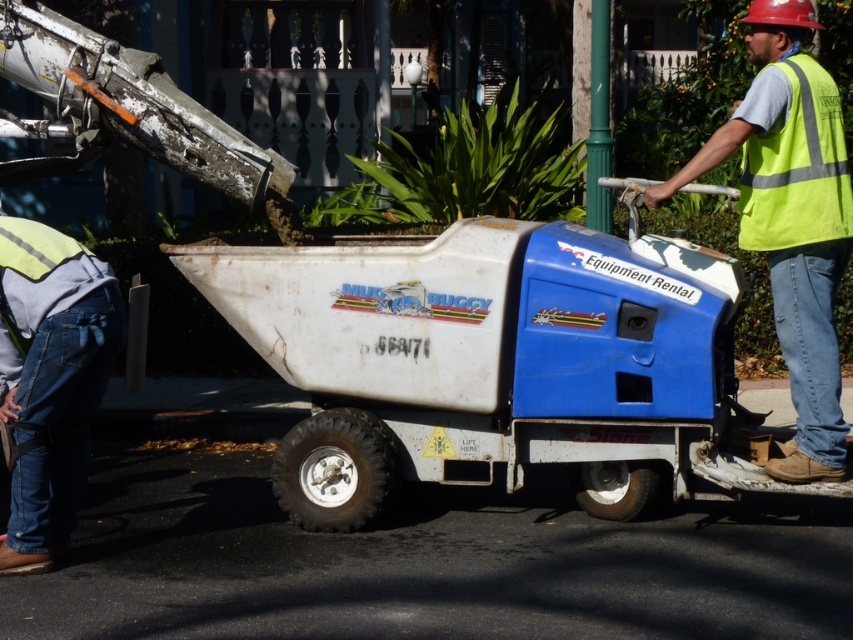
Can you confirm if white matte/rough muck buggy at center is bigger than reflective yellow vest at right?

Indeed, white matte/rough muck buggy at center has a larger size compared to reflective yellow vest at right.

Where is `white matte/rough muck buggy at center`? The height and width of the screenshot is (640, 853). white matte/rough muck buggy at center is located at coordinates (494, 362).

Which of these two, reflective yellow vest at right or denim jeans at lower left, stands shorter?

denim jeans at lower left is shorter.

Which is more to the left, reflective yellow vest at right or denim jeans at lower left?

denim jeans at lower left is more to the left.

Describe the element at coordinates (791, 218) in the screenshot. The image size is (853, 640). I see `reflective yellow vest at right` at that location.

Find the location of a particular element. The width and height of the screenshot is (853, 640). reflective yellow vest at right is located at coordinates (791, 218).

Describe the element at coordinates (494, 362) in the screenshot. The image size is (853, 640). I see `white matte/rough muck buggy at center` at that location.

In the scene shown: Is white matte/rough muck buggy at center shorter than denim jeans at lower left?

No.

You are a GUI agent. You are given a task and a screenshot of the screen. Output one action in this format:
    pyautogui.click(x=<x>, y=<y>)
    Task: Click on the white matte/rough muck buggy at center
    
    Given the screenshot: What is the action you would take?
    pyautogui.click(x=494, y=362)